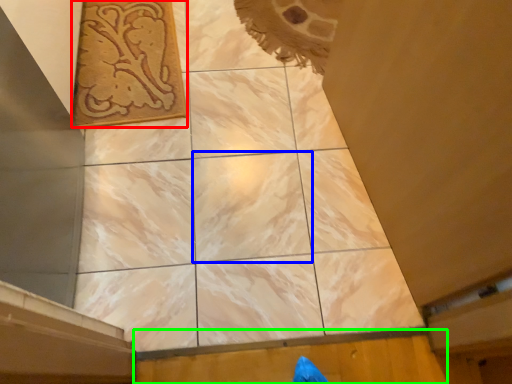
Question: Estimate the real-world distances between objects in this image. Which object is farther from design (highlighted by a red box), tile (highlighted by a blue box) or plywood (highlighted by a green box)?

Choices:
 (A) tile
 (B) plywood

Answer: (B)